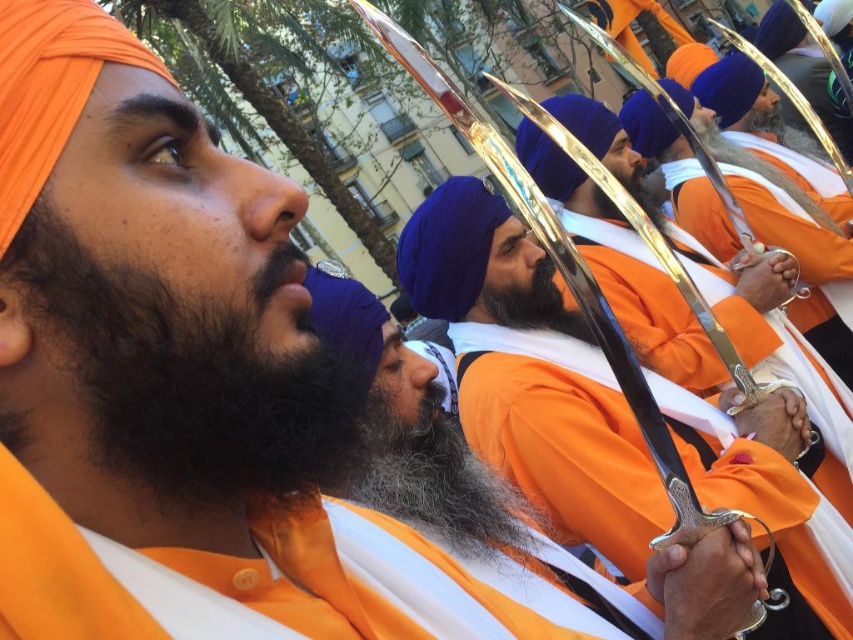
You are a photographer standing in the city square where this event is taking place. You want to capture a closeup of the shiny silver sword at center. Based on its coordinates, where should you aim your camera?

You should aim your camera at point 0.586 on the x axis and 0.624 on the y axis to capture the shiny silver sword at center.

You are a photographer at this event and want to capture a photo where the shiny silver sword at center is visible above the dark brown curly beard at left. Is this possible given their current positions?

The shiny silver sword at center is currently below the dark brown curly beard at left, so adjusting the camera angle upwards might be needed to frame the sword above the beard in the photo.